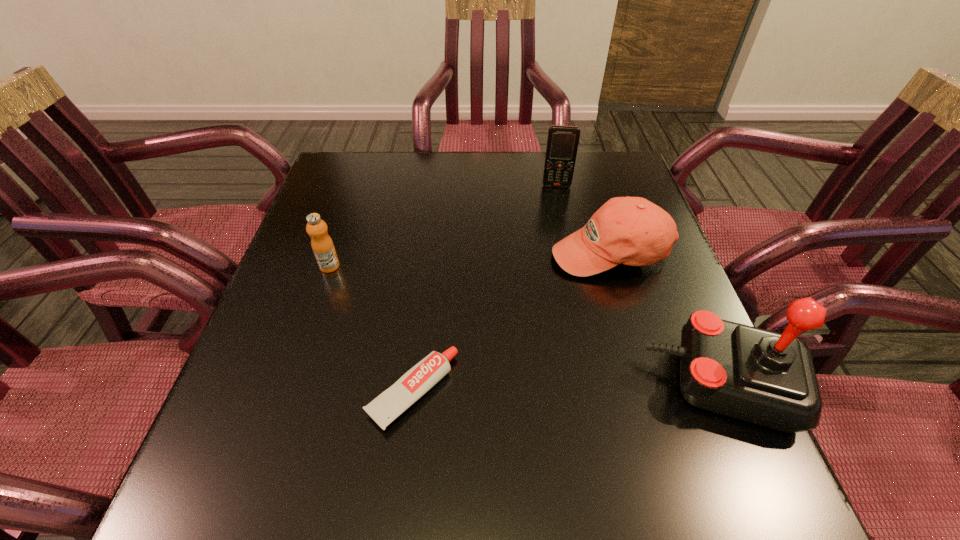
Where is `free space located 0.250m on the front label of the orange juice`? This screenshot has height=540, width=960. free space located 0.250m on the front label of the orange juice is located at coordinates (421, 318).

This screenshot has width=960, height=540. In order to click on free region located 0.110m on the front label of the orange juice in this screenshot , I will do `click(372, 290)`.

Locate an element on the screen. This screenshot has height=540, width=960. blank space located on the front-facing side of the baseball cap is located at coordinates (575, 352).

What are the coordinates of `free space located 0.180m on the front-facing side of the baseball cap` in the screenshot? It's located at (579, 340).

Find the location of `free point located 0.210m on the front-facing side of the baseball cap`. free point located 0.210m on the front-facing side of the baseball cap is located at coordinates (575, 352).

Where is `free space located on the screen of the cellular telephone`? free space located on the screen of the cellular telephone is located at coordinates (555, 257).

Locate an element on the screen. The height and width of the screenshot is (540, 960). free space located on the screen of the cellular telephone is located at coordinates (555, 254).

In order to click on free space located 0.310m on the screen of the cellular telephone in this screenshot , I will do `click(555, 266)`.

At what (x,y) coordinates should I click in order to perform the action: click on object located at the far edge. Please return your answer as a coordinate pair (x, y). This screenshot has width=960, height=540. Looking at the image, I should click on (562, 143).

Identify the location of toothpaste positioned at the near edge. This screenshot has height=540, width=960. (385, 408).